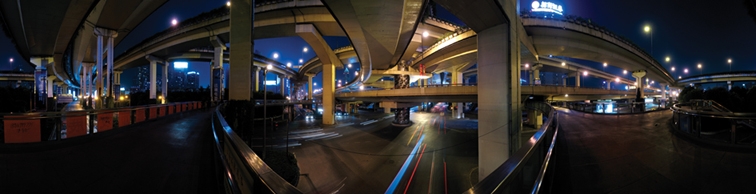
The height and width of the screenshot is (194, 756). Find the location of `lit up sign`. lit up sign is located at coordinates (553, 10).